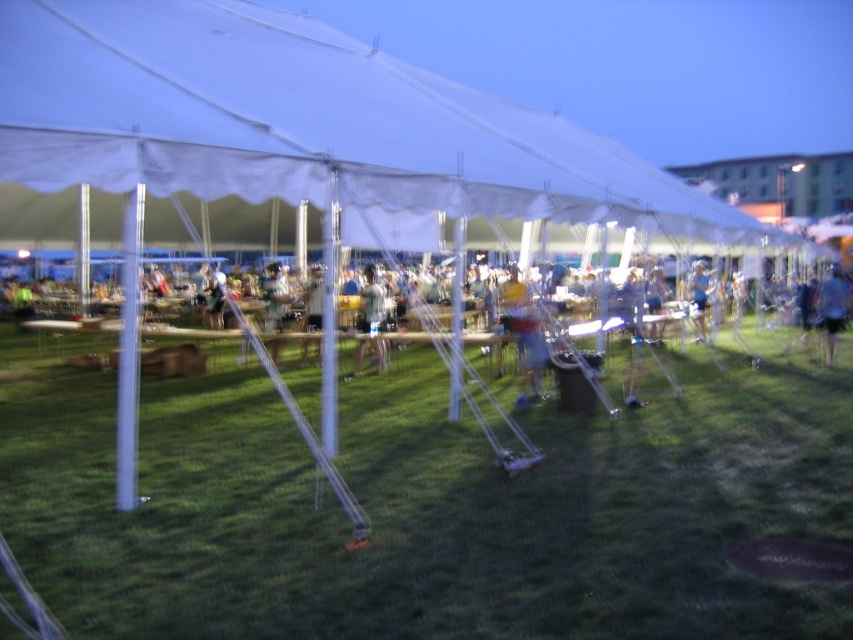
Question: Which point appears closest to the camera in this image?

Choices:
 (A) (363, 300)
 (B) (543, 548)
 (C) (155, 177)
 (D) (701, 296)

Answer: (B)

Question: Does white fabric canopy at upper center appear over blue fabric shorts at lower right?

Choices:
 (A) yes
 (B) no

Answer: (A)

Question: Can you confirm if white fabric canopy at upper center is positioned above light blue denim shorts at center?

Choices:
 (A) yes
 (B) no

Answer: (A)

Question: Which object is positioned farthest from the blue fabric shorts at lower right?

Choices:
 (A) white fabric canopy at upper center
 (B) green grass at lower center
 (C) blue fabric shirt at right
 (D) light blue denim shorts at center

Answer: (D)

Question: Is green grass at lower center smaller than blue fabric shorts at lower right?

Choices:
 (A) yes
 (B) no

Answer: (B)

Question: Among these points, which one is nearest to the camera?

Choices:
 (A) (x=383, y=296)
 (B) (x=703, y=330)
 (C) (x=683, y=486)
 (D) (x=825, y=276)

Answer: (C)